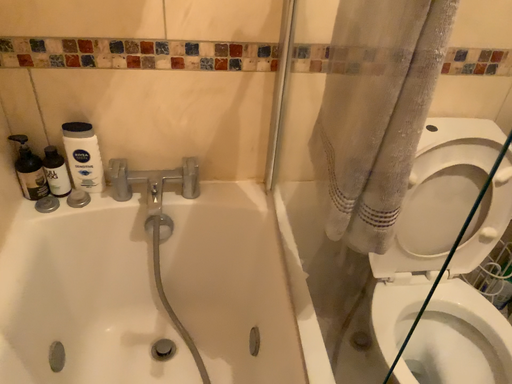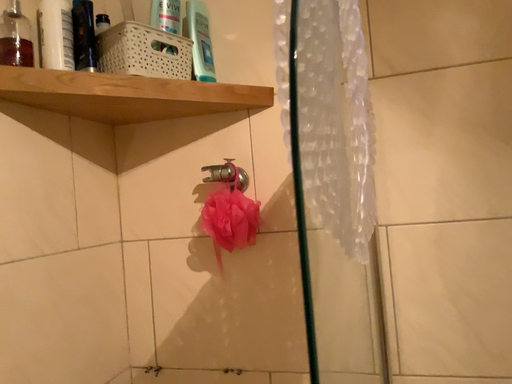
Question: Which way did the camera rotate in the video?

Choices:
 (A) rotated right
 (B) rotated left

Answer: (B)